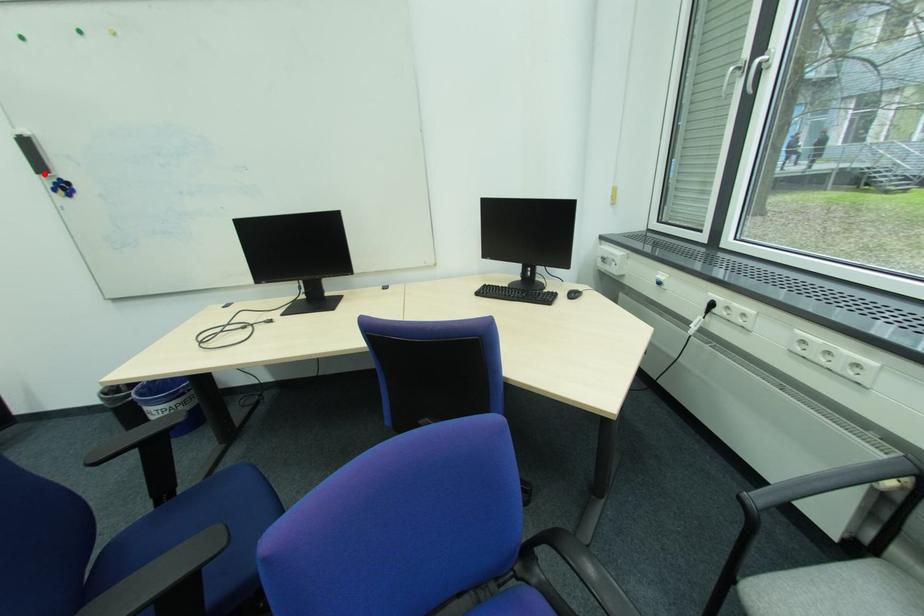
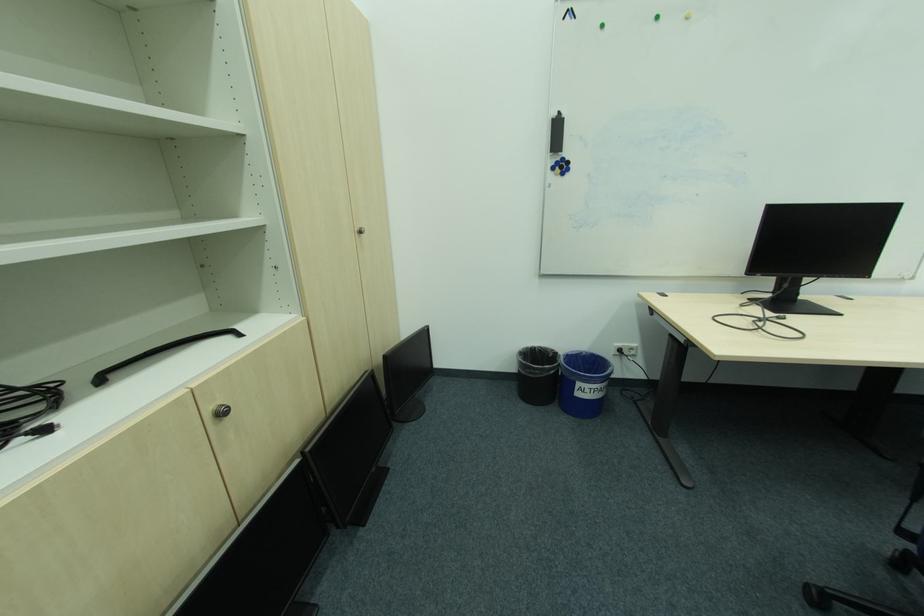
Question: I am providing you with two images of the same scene from different viewpoints. A red point is marked on the first image. At the location where the point appears in image 1, is it still visible in image 2?

Choices:
 (A) Yes
 (B) No

Answer: (A)